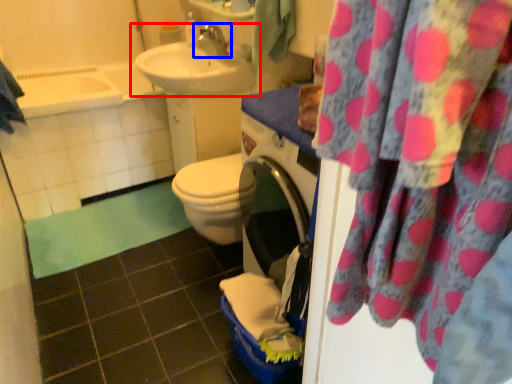
Question: Among these objects, which one is nearest to the camera, sink (highlighted by a red box) or tap (highlighted by a blue box)?

Choices:
 (A) sink
 (B) tap

Answer: (A)